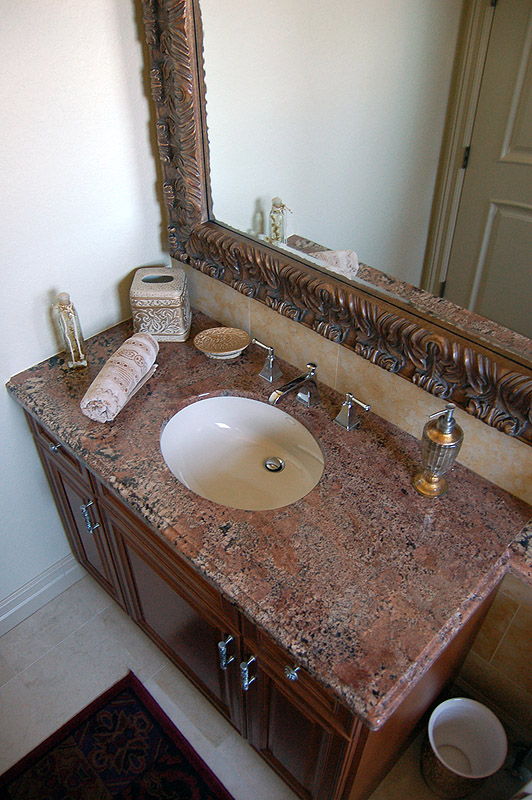
This screenshot has height=800, width=532. I want to click on chrome hardware, so click(x=88, y=518), click(x=226, y=650), click(x=247, y=674), click(x=289, y=674), click(x=268, y=366), click(x=302, y=385), click(x=350, y=410).